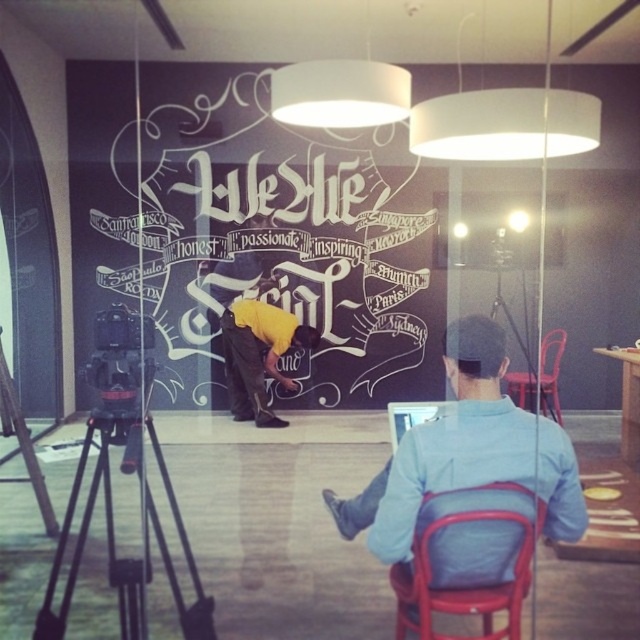
Who is more distant from viewer, (452,609) or (252,378)?

A: The point (252,378) is more distant.

Is metallic red chair at lower right above yellow matte shirt at center?

Incorrect, metallic red chair at lower right is not positioned above yellow matte shirt at center.

Locate an element on the screen. This screenshot has height=640, width=640. metallic red chair at lower right is located at coordinates (468, 557).

Is point (472, 529) farther from camera compared to point (64, 545)?

No, (472, 529) is closer to viewer.

Which is above, metallic red chair at lower right or black metal tripod at lower left?

black metal tripod at lower left

Which is behind, point (403, 572) or point (136, 456)?

Positioned behind is point (136, 456).

Identify the location of metallic red chair at lower right. This screenshot has height=640, width=640. (468, 557).

Is white chalkboard at center above light blue shirt at center?

Yes, white chalkboard at center is above light blue shirt at center.

Identify the location of white chalkboard at center. (284, 241).

Who is more forward, (93,221) or (330,508)?

Point (93,221) is more forward.

Image resolution: width=640 pixels, height=640 pixels. Find the location of `white chalkboard at center`. white chalkboard at center is located at coordinates (284, 241).